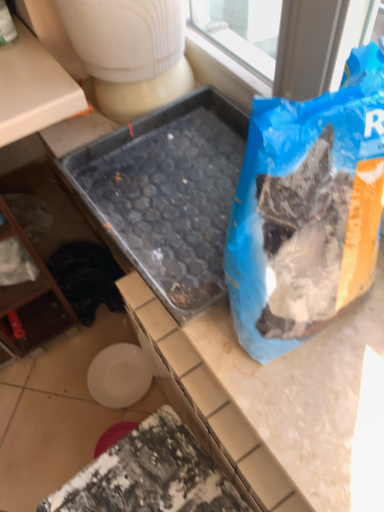
At what (x,y) coordinates should I click in order to perform the action: click on free spot behind blue plastic bag at upper right. Please return your answer as a coordinate pair (x, y). The width and height of the screenshot is (384, 512). Looking at the image, I should click on (198, 196).